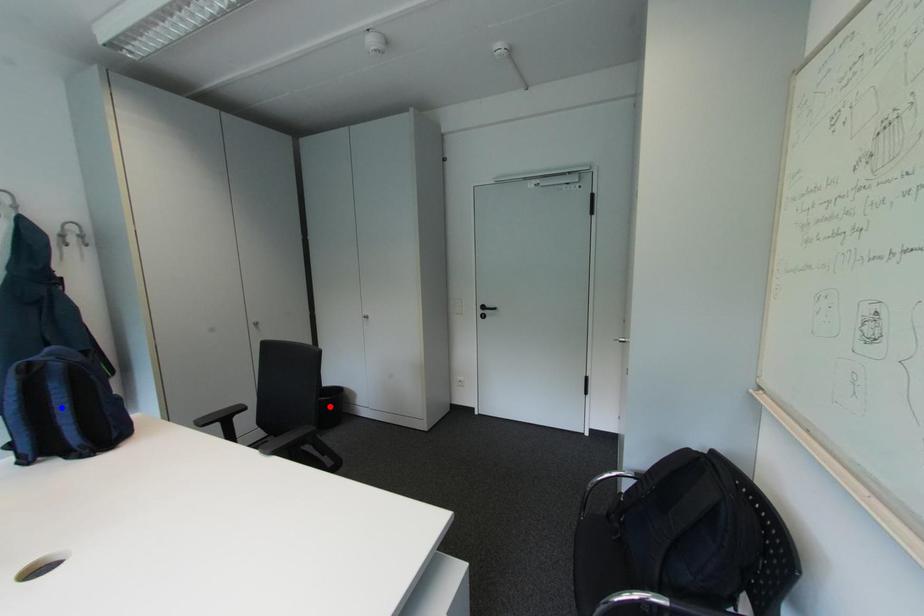
Question: Two points are marked on the image. Which point is closer to the camera?

Choices:
 (A) Blue point is closer.
 (B) Red point is closer.

Answer: (A)